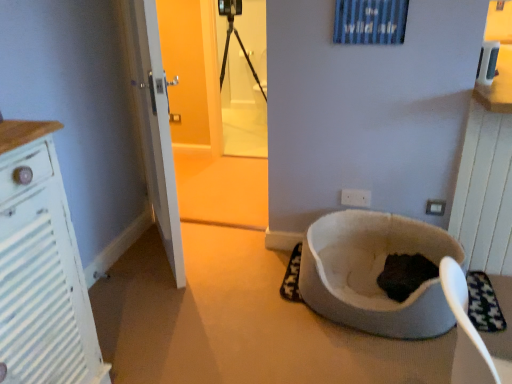
Question: From a real-world perspective, is transparent plastic screen door at upper center physically located above or below white textured cabinet at left?

Choices:
 (A) above
 (B) below

Answer: (A)

Question: In terms of width, does transparent plastic screen door at upper center look wider or thinner when compared to white textured cabinet at left?

Choices:
 (A) thin
 (B) wide

Answer: (A)

Question: Which is farther from the transparent plastic screen door at upper center?

Choices:
 (A) white plastic electric outlet at lower right, placed as the 2th electric outlet when sorted from left to right
 (B) white plastic electric outlet at center, which appears as the second electric outlet when viewed from the right
 (C) white textured cabinet at left
 (D) white fabric cat bed at lower right

Answer: (C)

Question: Which object is the farthest from the white textured cabinet at left?

Choices:
 (A) white fabric cat bed at lower right
 (B) white plastic electric outlet at center, which appears as the second electric outlet when viewed from the right
 (C) transparent plastic screen door at upper center
 (D) white plastic electric outlet at lower right, placed as the 2th electric outlet when sorted from back to front

Answer: (C)